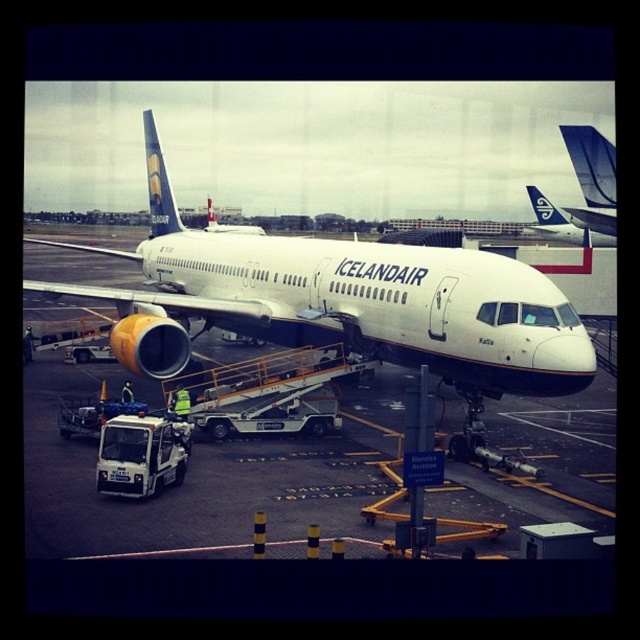
Where is `white matte airplane at center`? The height and width of the screenshot is (640, 640). white matte airplane at center is located at coordinates (340, 301).

Is white matte airplane at center shorter than white matte airplane at upper center?

No.

Which is in front, point (465, 376) or point (595, 244)?

Point (465, 376) is more forward.

Image resolution: width=640 pixels, height=640 pixels. I want to click on white matte airplane at center, so click(340, 301).